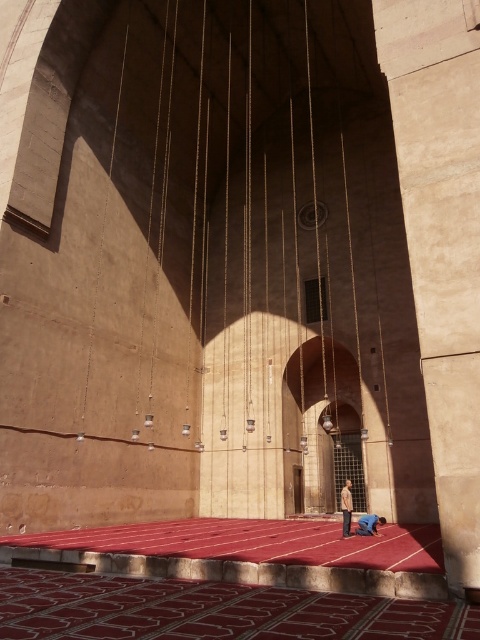
Is brown leather jacket at center positioned at the back of blue fabric at lower center?

Yes, brown leather jacket at center is further from the viewer.

Is brown leather jacket at center above blue fabric at lower center?

No, brown leather jacket at center is not above blue fabric at lower center.

Does point (347, 492) come behind point (365, 531)?

Yes.

Where is `brown leather jacket at center`? This screenshot has height=640, width=480. brown leather jacket at center is located at coordinates (347, 508).

How much distance is there between sandy beige stone pillar at right and blue fabric at lower center?

The distance of sandy beige stone pillar at right from blue fabric at lower center is 17.75 meters.

Does sandy beige stone pillar at right appear on the right side of blue fabric at lower center?

No, sandy beige stone pillar at right is not to the right of blue fabric at lower center.

Find the location of a particular element. sandy beige stone pillar at right is located at coordinates click(x=442, y=240).

Is sandy beige stone pillar at right shorter than brown leather jacket at center?

No.

Between sandy beige stone pillar at right and brown leather jacket at center, which one has less height?

Standing shorter between the two is brown leather jacket at center.

In order to click on sandy beige stone pillar at right in this screenshot , I will do `click(442, 240)`.

You are a GUI agent. You are given a task and a screenshot of the screen. Output one action in this format:
    pyautogui.click(x=<x>, y=<y>)
    Task: Click on the sandy beige stone pillar at right
    This screenshot has width=480, height=640.
    Given the screenshot: What is the action you would take?
    pyautogui.click(x=442, y=240)